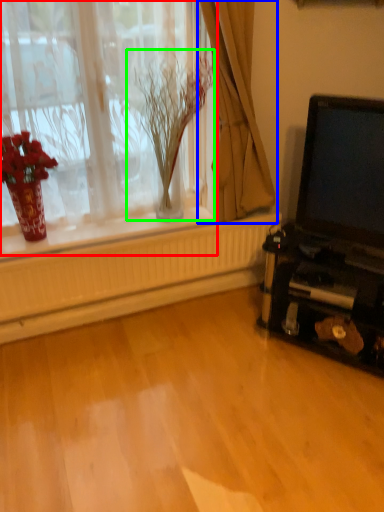
Question: Considering the real-world distances, which object is farthest from window (highlighted by a red box)? curtain (highlighted by a blue box) or plant (highlighted by a green box)?

Choices:
 (A) curtain
 (B) plant

Answer: (A)